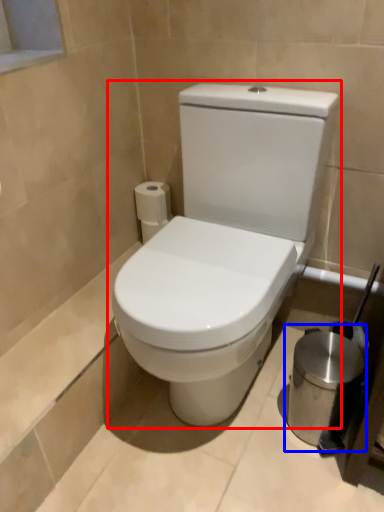
Question: Which object appears closest to the camera in this image, toilet (highlighted by a red box) or appliance (highlighted by a blue box)?

Choices:
 (A) toilet
 (B) appliance

Answer: (A)